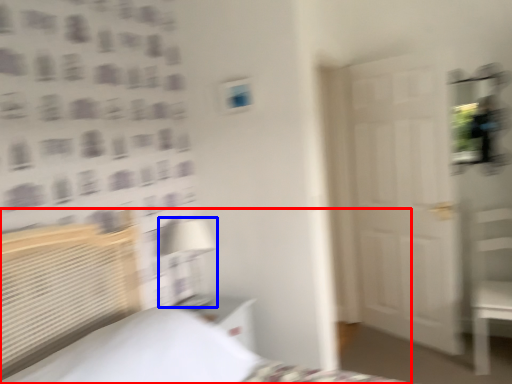
Question: Which point is closer to the camera, bed (highlighted by a red box) or table lamp (highlighted by a blue box)?

Choices:
 (A) bed
 (B) table lamp

Answer: (A)